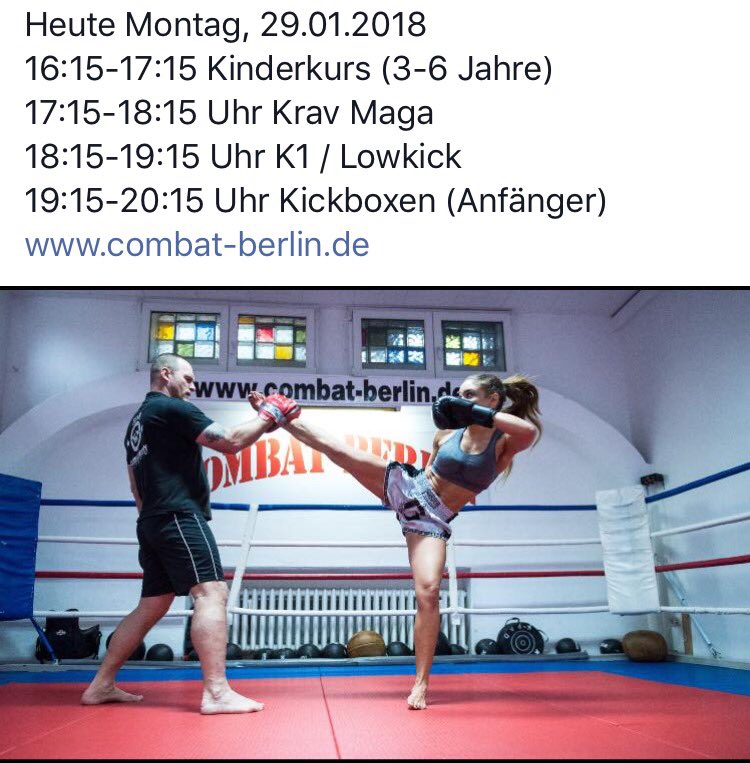
You are a GUI agent. You are given a task and a screenshot of the screen. Output one action in this format:
    pyautogui.click(x=<x>, y=<y>)
    Task: Click on the red mat
    This screenshot has width=750, height=763.
    Given the screenshot: What is the action you would take?
    pyautogui.click(x=375, y=716)